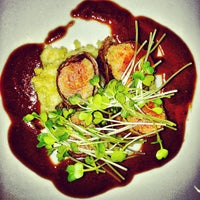
At what (x,y) coordinates should I click in order to perform the action: click on white plate. Please return your answer as a coordinate pair (x, y). Looking at the image, I should click on (148, 181).